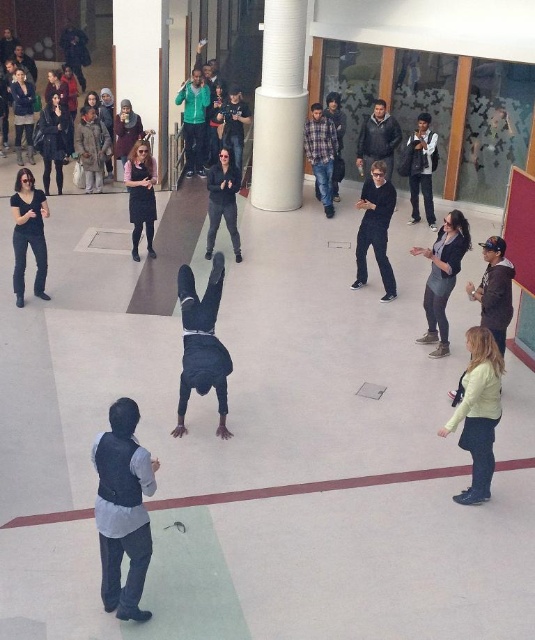
Between light brown leather jacket at lower right and matte black pants at center, which one appears on the left side from the viewer's perspective?

Positioned to the left is matte black pants at center.

Looking at this image, does light brown leather jacket at lower right appear on the right side of matte black pants at center?

Yes, light brown leather jacket at lower right is to the right of matte black pants at center.

Image resolution: width=535 pixels, height=640 pixels. Describe the element at coordinates (477, 412) in the screenshot. I see `light brown leather jacket at lower right` at that location.

Identify the location of light brown leather jacket at lower right. This screenshot has height=640, width=535. (477, 412).

Is matte black shirt at left to the left of matte black pants at center from the viewer's perspective?

Indeed, matte black shirt at left is positioned on the left side of matte black pants at center.

Does matte black shirt at left appear on the right side of matte black pants at center?

Incorrect, matte black shirt at left is not on the right side of matte black pants at center.

Locate an element on the screen. matte black shirt at left is located at coordinates (28, 234).

The height and width of the screenshot is (640, 535). I want to click on matte black shirt at left, so click(x=28, y=234).

Which of these two, black matte person at center or plaid fabric shirt at upper center, stands taller?

plaid fabric shirt at upper center

Is black matte person at center taller than plaid fabric shirt at upper center?

No, black matte person at center is not taller than plaid fabric shirt at upper center.

The image size is (535, 640). Describe the element at coordinates (202, 344) in the screenshot. I see `black matte person at center` at that location.

This screenshot has width=535, height=640. What are the coordinates of `black matte person at center` in the screenshot? It's located at (202, 344).